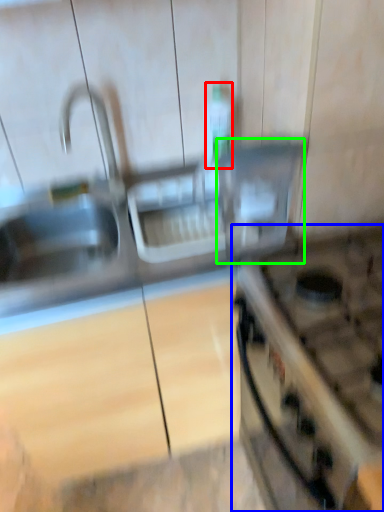
Question: Based on their relative distances, which object is nearer to bottle (highlighted by a red box)? Choose from gas stove (highlighted by a blue box) and appliance (highlighted by a green box).

Choices:
 (A) gas stove
 (B) appliance

Answer: (B)